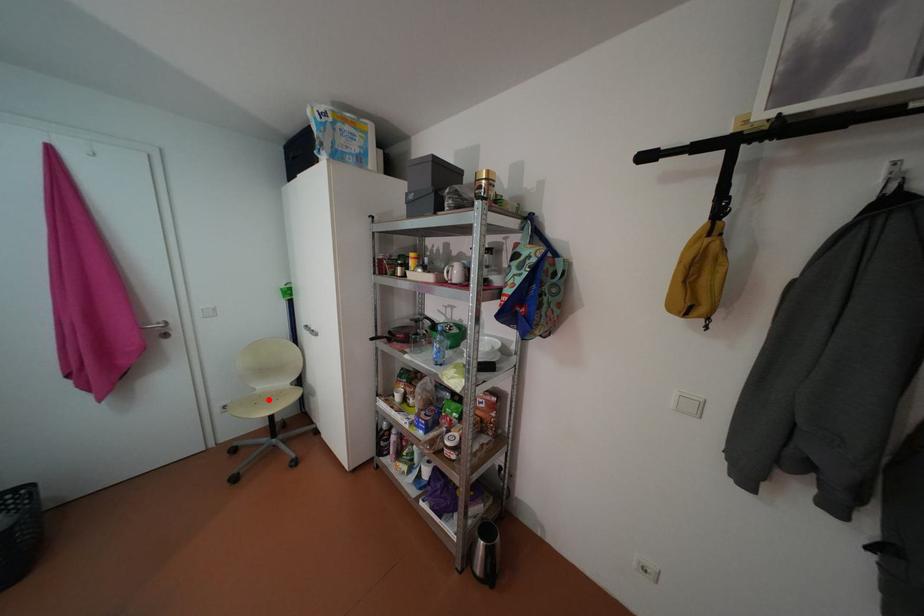
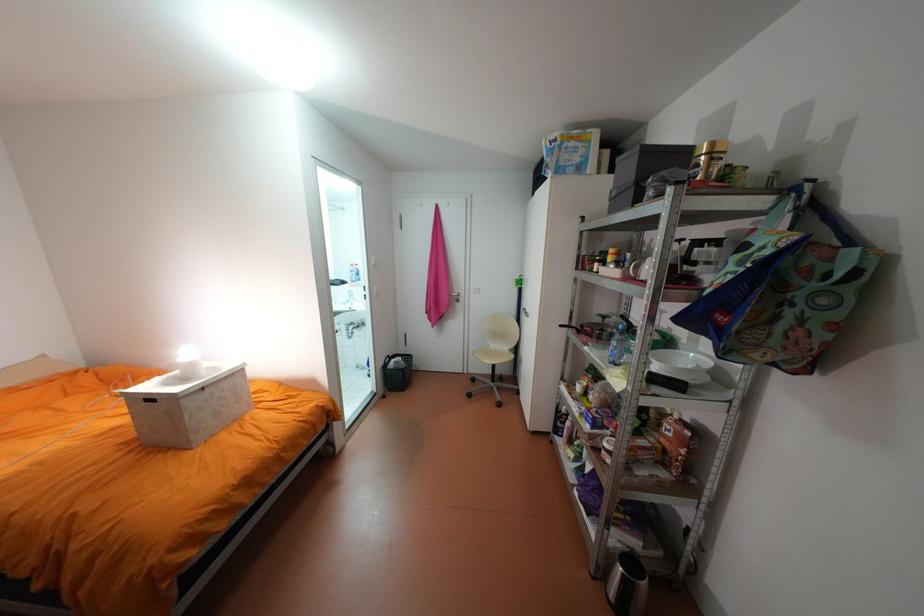
Locate, in the second image, the point that corresponds to the highlighted location in the first image.

(497, 352)